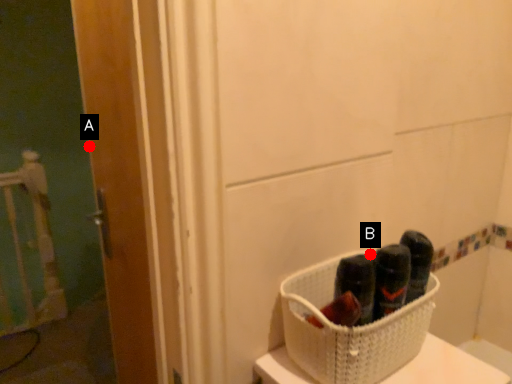
Question: Two points are circled on the image, labeled by A and B beside each circle. Which point is farther to the camera?

Choices:
 (A) A is further
 (B) B is further

Answer: (A)